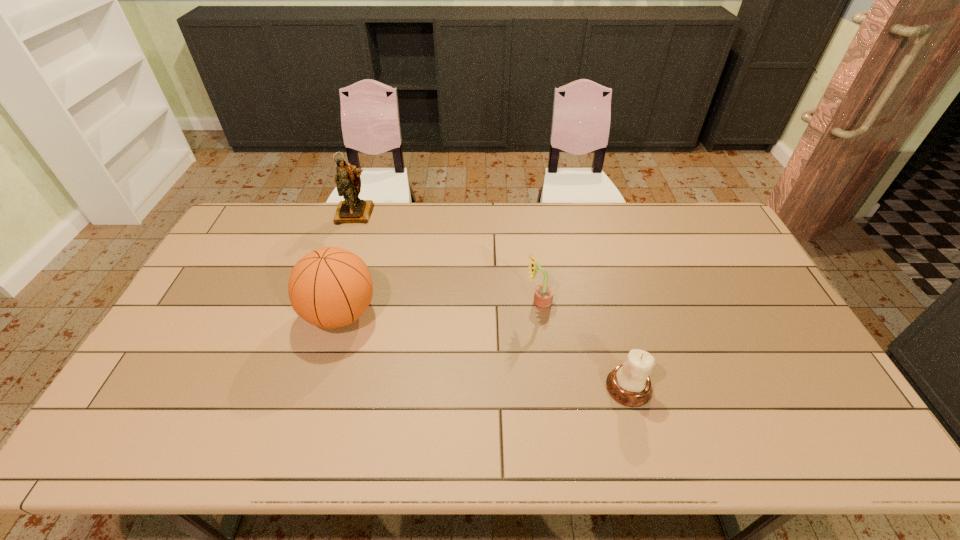
The image size is (960, 540). I want to click on the farthest object, so click(352, 210).

I want to click on basketball, so click(x=330, y=287).

Identify the location of the third object from left to right. The image size is (960, 540). (543, 296).

At what (x,y) coordinates should I click in order to perform the action: click on the second shortest object. Please return your answer as a coordinate pair (x, y). This screenshot has width=960, height=540. Looking at the image, I should click on (543, 296).

Find the location of a particular element. the rightmost object is located at coordinates (629, 384).

Where is `candle holder`? The image size is (960, 540). candle holder is located at coordinates (629, 384).

Locate an element on the screen. The height and width of the screenshot is (540, 960). vacant space located on the front-facing side of the farthest object is located at coordinates (333, 282).

Locate an element on the screen. The image size is (960, 540). vacant space located on the right of the basketball is located at coordinates (500, 314).

At what (x,y) coordinates should I click in order to perform the action: click on free point located 0.270m on the face of the sunflower. Please return your answer as a coordinate pair (x, y). The image size is (960, 540). Looking at the image, I should click on [x=436, y=303].

Where is `free space located 0.050m on the face of the sunflower`? This screenshot has width=960, height=540. free space located 0.050m on the face of the sunflower is located at coordinates (508, 303).